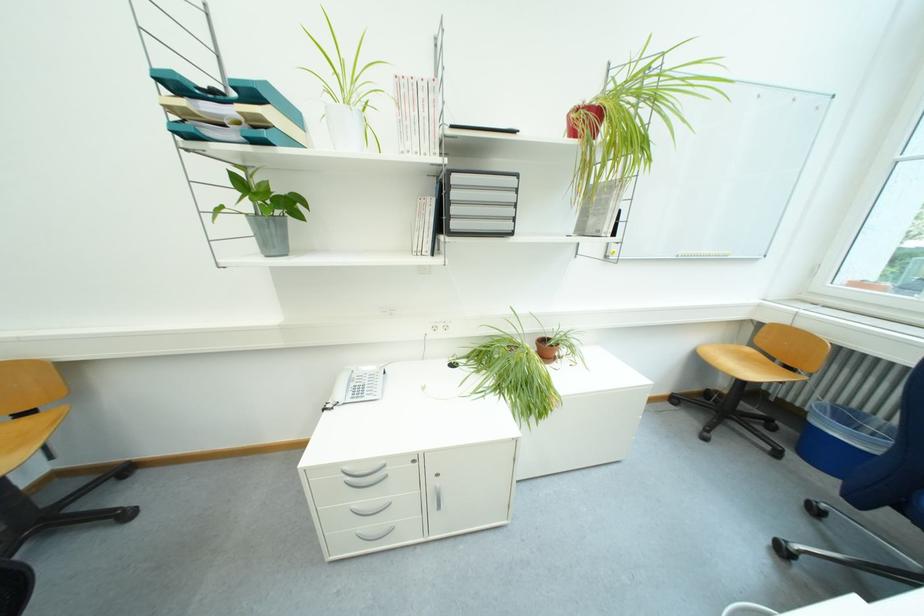
The width and height of the screenshot is (924, 616). What are the coordinates of `blue chair sitting surface` in the screenshot? It's located at (829, 453).